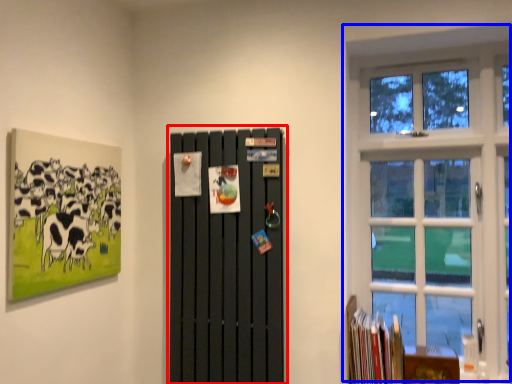
Question: Among these objects, which one is farthest to the camera, barn door (highlighted by a red box) or window (highlighted by a blue box)?

Choices:
 (A) barn door
 (B) window

Answer: (B)